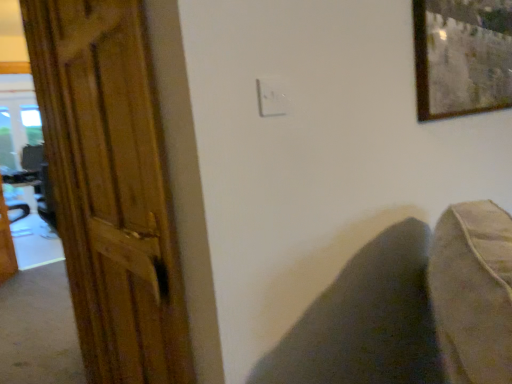
Question: Is white plastic electric outlet at center bigger or smaller than wooden table at left?

Choices:
 (A) small
 (B) big

Answer: (A)

Question: From the image's perspective, is white plastic electric outlet at center located above or below wooden table at left?

Choices:
 (A) below
 (B) above

Answer: (B)

Question: Which object is positioned closest to the wooden door at left?

Choices:
 (A) white plastic electric outlet at center
 (B) dark fabric swivel chair at lower right
 (C) wooden table at left
 (D) wooden-framed artwork at upper right

Answer: (B)

Question: Which of these objects is positioned farthest from the dark fabric swivel chair at lower right?

Choices:
 (A) wooden door at left
 (B) white plastic electric outlet at center
 (C) wooden-framed artwork at upper right
 (D) wooden table at left

Answer: (D)